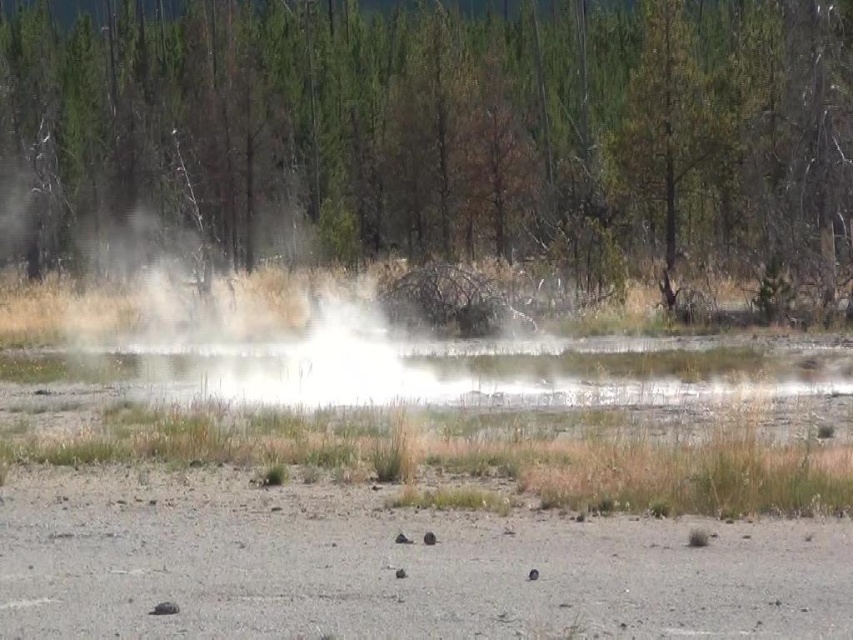
Which is in front, point (682, 122) or point (363, 364)?

Point (363, 364)

Can you confirm if green textured tree at center is wider than white steam at center?

Correct, the width of green textured tree at center exceeds that of white steam at center.

Which is behind, point (567, 208) or point (231, 353)?

The point (567, 208) is more distant.

Find the location of `green textured tree at center`. green textured tree at center is located at coordinates (447, 129).